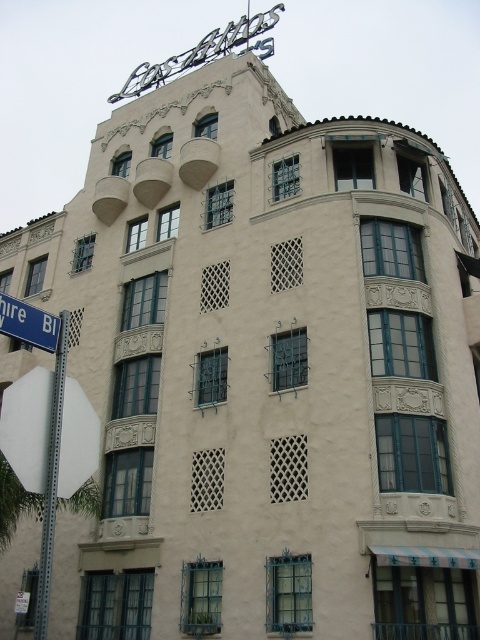
You are a delivery driver who needs to park your truck near the building. The truck requires a parking space that is at least 2 meters wide. You see the metallic pole at left and the blue plastic street sign at left. Which object should you avoid to ensure enough space for your truck?

The metallic pole at left is larger in size than the blue plastic street sign at left, so you should avoid the metallic pole at left to ensure there is enough space for the truck.

You are standing in front of the building and want to locate the metallic pole at left. Where would you look?

You should look at point (51, 481) to find the metallic pole at left.